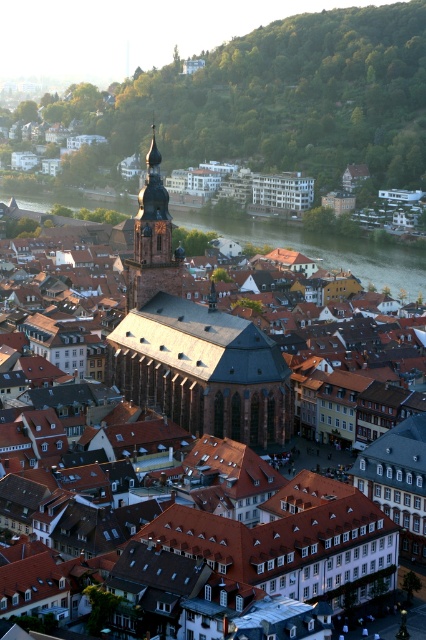
Question: Which object is farther from the camera taking this photo?

Choices:
 (A) smooth copper spire at center
 (B) green water at center

Answer: (B)

Question: Can you confirm if green water at center is positioned above smooth copper spire at center?

Choices:
 (A) no
 (B) yes

Answer: (A)

Question: Where is green water at center located in relation to smooth copper spire at center in the image?

Choices:
 (A) right
 (B) left

Answer: (A)

Question: Is green water at center to the right of smooth copper spire at center from the viewer's perspective?

Choices:
 (A) no
 (B) yes

Answer: (B)